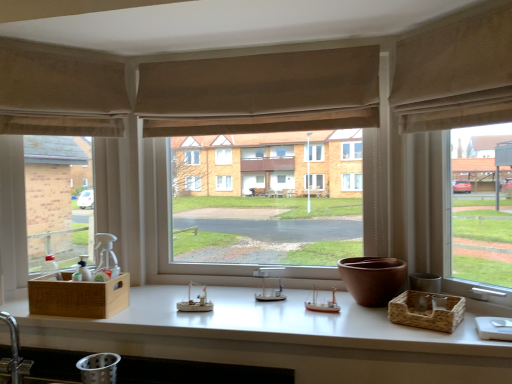
I want to click on blank space situated above beige fabric curtain at upper right, placed as the second curtain when sorted from left to right (from a real-world perspective), so click(439, 22).